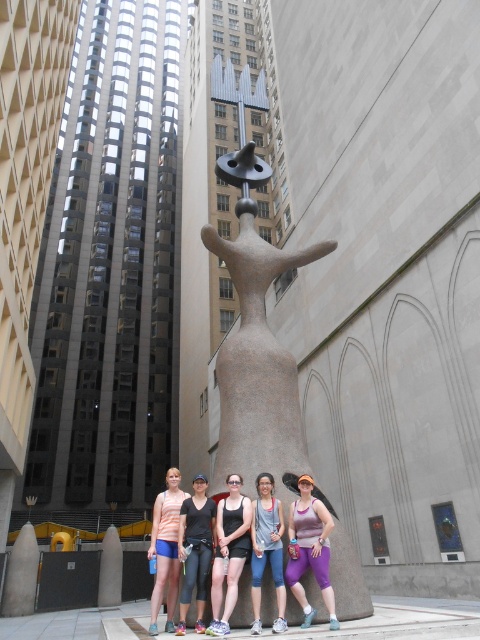
Is purple leggings at center positioned behind gray fabric tank top at center?

No, purple leggings at center is in front of gray fabric tank top at center.

Is purple leggings at center shorter than gray fabric tank top at center?

No, purple leggings at center is not shorter than gray fabric tank top at center.

The image size is (480, 640). What do you see at coordinates (310, 548) in the screenshot?
I see `purple leggings at center` at bounding box center [310, 548].

Where is `purple leggings at center`? This screenshot has width=480, height=640. purple leggings at center is located at coordinates (310, 548).

Based on the photo, is matte black tank top at center further to the viewer compared to gray fabric tank top at center?

No, it is not.

Between point (225, 618) and point (282, 532), which one is positioned in front?

Positioned in front is point (225, 618).

Is point (222, 628) positioned behind point (257, 628)?

That is False.

Locate an element on the screen. This screenshot has width=480, height=640. matte black tank top at center is located at coordinates (228, 552).

Between point (262, 289) and point (254, 625), which one is positioned behind?

Positioned behind is point (262, 289).

At what (x,y) coordinates should I click in order to perform the action: click on brown stone statue at center. Please return your answer as a coordinate pair (x, y). The width and height of the screenshot is (480, 640). Looking at the image, I should click on (255, 337).